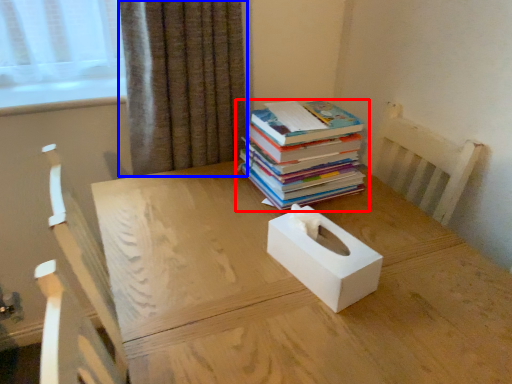
Question: Which object is closer to the camera taking this photo, book (highlighted by a red box) or curtain (highlighted by a blue box)?

Choices:
 (A) book
 (B) curtain

Answer: (A)